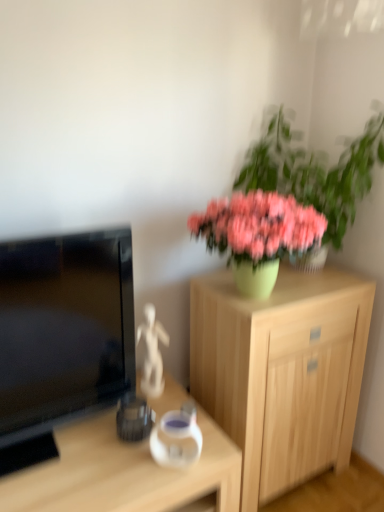
Question: Looking at the image, does transparent glass vase at center seem bigger or smaller compared to light wood cabinet at center?

Choices:
 (A) small
 (B) big

Answer: (A)

Question: From a real-world perspective, is transparent glass vase at center above or below light wood cabinet at center?

Choices:
 (A) above
 (B) below

Answer: (A)

Question: Based on their relative distances, which object is farther from the light wood cabinet at center?

Choices:
 (A) matte black television at left
 (B) transparent glass vase at center
 (C) green matte vase at upper right
 (D) matte wood desk at lower left

Answer: (A)

Question: Estimate the real-world distances between objects in this image. Which object is closer to the transparent glass vase at center?

Choices:
 (A) matte black television at left
 (B) light wood cabinet at center
 (C) matte wood desk at lower left
 (D) green matte vase at upper right

Answer: (C)